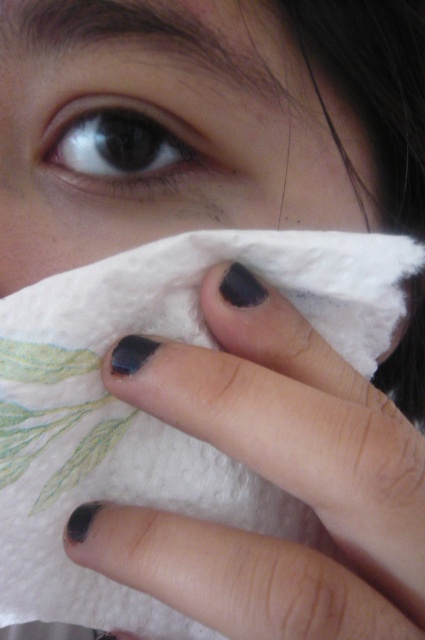
Can you confirm if white paper towel at lower center is positioned to the left of black matte eye at upper left?

In fact, white paper towel at lower center is to the right of black matte eye at upper left.

Is white paper towel at lower center wider than black matte eye at upper left?

Yes.

Between point (155, 154) and point (167, 118), which one is positioned behind?

Positioned behind is point (155, 154).

Where is `white paper towel at lower center`? The image size is (425, 640). white paper towel at lower center is located at coordinates (164, 129).

Which is behind, point (51, 51) or point (342, 458)?

Point (51, 51)

Does white paper towel at lower center lie behind dark matte nail polish at center?

Yes.

Is point (300, 100) positioned before point (418, 573)?

No, (300, 100) is behind (418, 573).

Identify the location of white paper towel at lower center. The width and height of the screenshot is (425, 640). (164, 129).

Who is lower down, dark matte nail polish at center or black matte eye at upper left?

dark matte nail polish at center is lower down.

Looking at this image, is dark matte nail polish at center in front of black matte eye at upper left?

Yes.

Does point (229, 573) come farther from viewer compared to point (62, 173)?

No, it is in front of (62, 173).

This screenshot has width=425, height=640. I want to click on dark matte nail polish at center, so click(x=271, y=477).